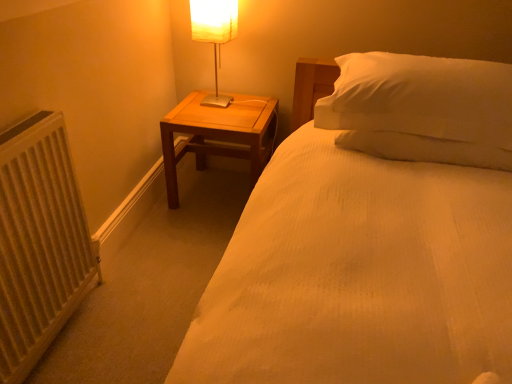
Question: From a real-world perspective, relative to white fabric-covered lamp at upper left, is wooden nightstand at center vertically above or below?

Choices:
 (A) above
 (B) below

Answer: (B)

Question: Visually, is wooden nightstand at center positioned to the left or to the right of white fabric-covered lamp at upper left?

Choices:
 (A) left
 (B) right

Answer: (B)

Question: Which is nearer to the white fabric-covered lamp at upper left?

Choices:
 (A) wooden nightstand at center
 (B) white textured radiator at left

Answer: (A)

Question: Based on their relative distances, which object is farther from the white textured radiator at left?

Choices:
 (A) wooden nightstand at center
 (B) white fabric-covered lamp at upper left

Answer: (B)